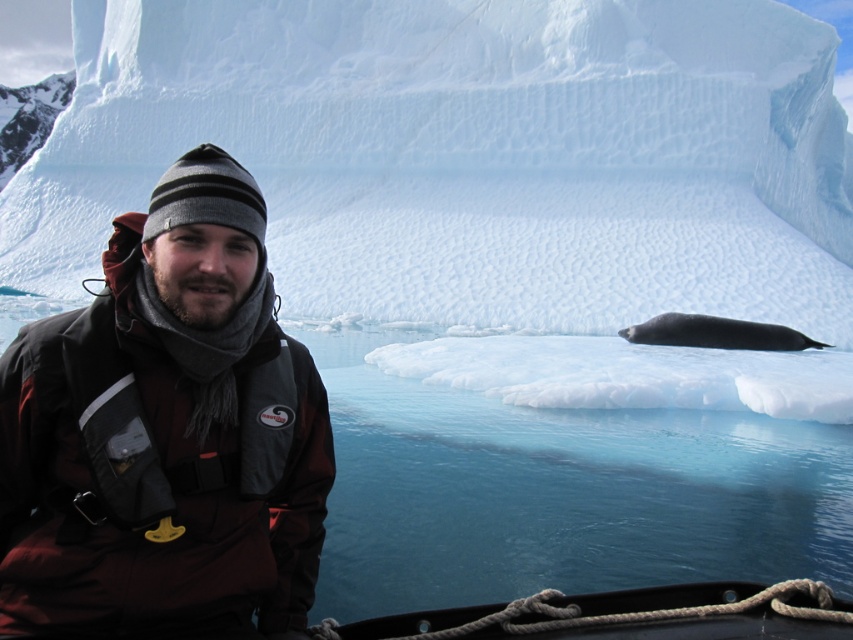
Which is in front, point (730, 72) or point (267, 614)?

Point (267, 614) is more forward.

At what (x,y) coordinates should I click in order to perform the action: click on white ice at center. Please return your answer as a coordinate pair (x, y). Image resolution: width=853 pixels, height=640 pixels. Looking at the image, I should click on (462, 154).

Can you confirm if white ice at center is bigger than transparent blue water at lower center?

Yes, white ice at center is bigger than transparent blue water at lower center.

Is the position of white ice at center less distant than that of transparent blue water at lower center?

That is False.

Which is behind, point (747, 275) or point (445, 412)?

The point (747, 275) is behind.

Locate an element on the screen. The image size is (853, 640). white ice at center is located at coordinates (462, 154).

Measure the distance between dark gray knit hat at upper left and camera.

They are 4.41 meters apart.

Between dark gray knit hat at upper left and gray smooth seal at center, which one has less height?

gray smooth seal at center is shorter.

Is point (209, 376) behind point (662, 336)?

No, it is in front of (662, 336).

Find the location of `dark gray knit hat at upper left`. dark gray knit hat at upper left is located at coordinates (165, 435).